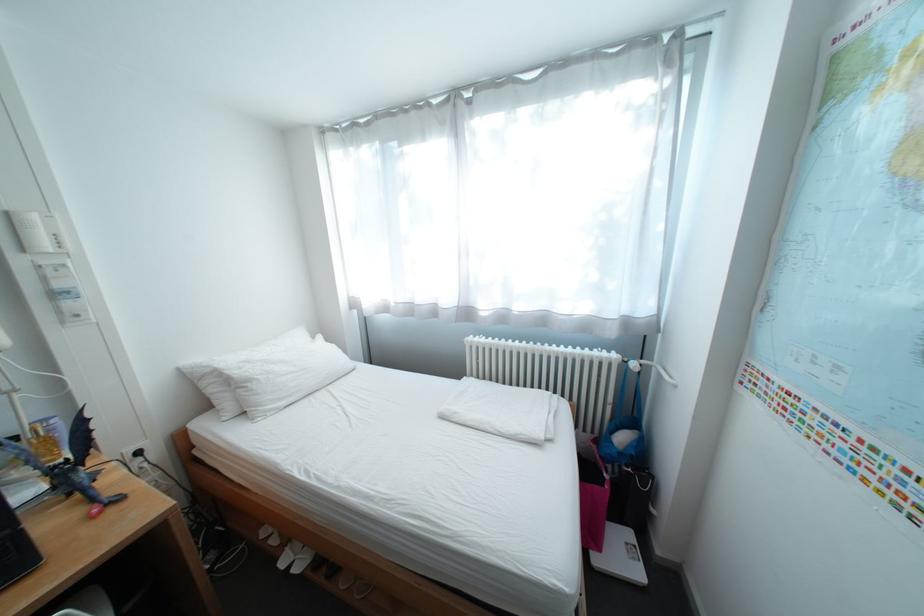
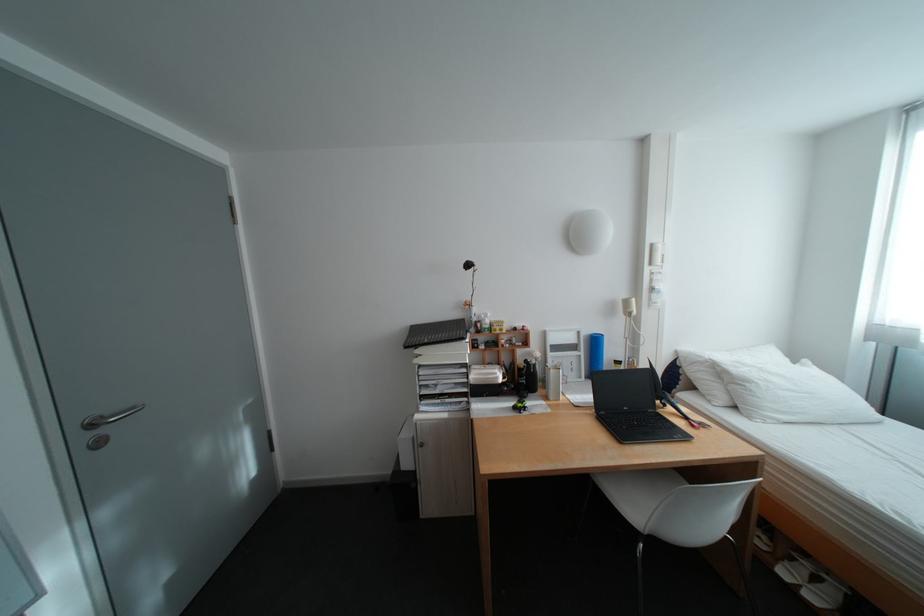
Locate, in the second image, the point that corresponds to pixel 307 562 in the first image.

(813, 586)